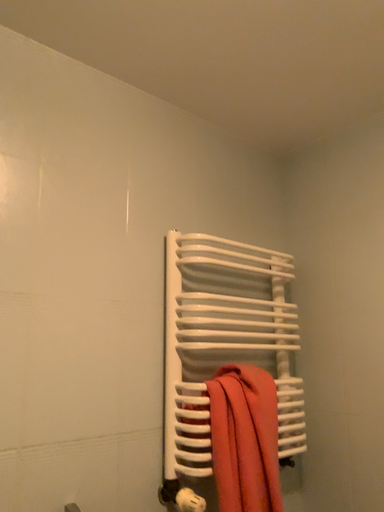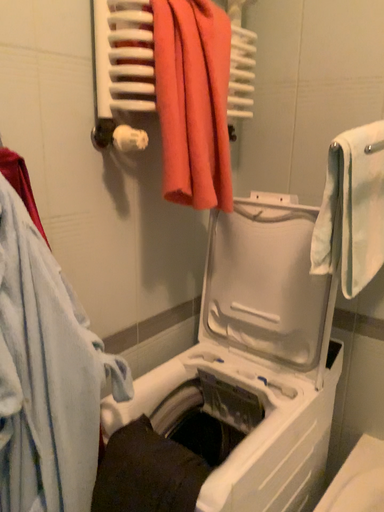
Question: Which way did the camera rotate in the video?

Choices:
 (A) rotated left
 (B) rotated right

Answer: (B)